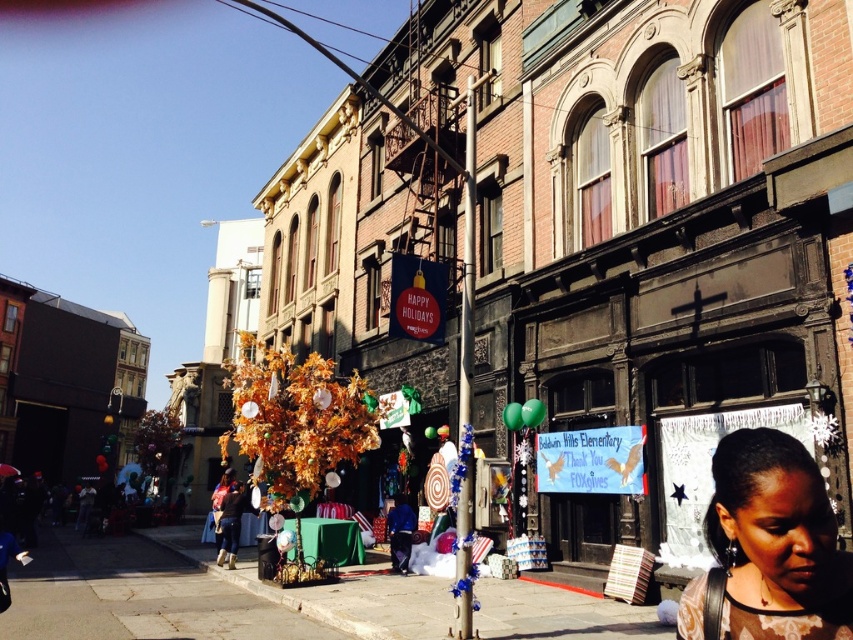
Looking at this image, you are standing in the festive street scene and notice a person with matte brown hair at lower right. Where exactly is this person located in relation to the other elements in the scene?

The matte brown hair at lower right is located at point coordinates approximately 0.855 on the x axis and 0.903 on the y axis.

Based on the photo, you are a photographer trying to capture a clear shot of the festive street scene. You want to focus on the matte brown hair at lower right and the matte black crowd at lower left. Which object should you adjust your camera angle to prioritize if you want to ensure both are in the frame without one blocking the other?

The matte brown hair at lower right is located above the matte black crowd at lower left. To ensure both are visible without one blocking the other, prioritize adjusting your camera angle to include the matte brown hair at lower right first, as it is positioned higher and might be obscuring the lower area where the matte black crowd at lower left is located.